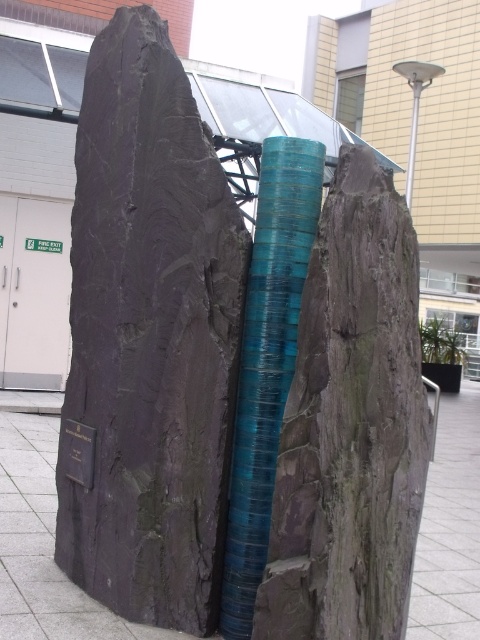
Can you confirm if teal glossy tube at center is positioned to the right of metallic pole at upper right?

In fact, teal glossy tube at center is to the left of metallic pole at upper right.

Describe the element at coordinates (266, 362) in the screenshot. I see `teal glossy tube at center` at that location.

This screenshot has width=480, height=640. What are the coordinates of `teal glossy tube at center` in the screenshot? It's located at (266, 362).

Which is more to the right, rough stone boulder at center or metallic pole at upper right?

Positioned to the right is metallic pole at upper right.

Between point (273, 628) and point (411, 128), which one is positioned in front?

Positioned in front is point (273, 628).

Find the location of `rough stone boulder at center`. rough stone boulder at center is located at coordinates point(350,426).

Identify the location of rough stone boulder at center. 350,426.

Which is in front, point (344, 524) or point (228, 596)?

Point (344, 524)

Does point (268, 602) lie behind point (256, 529)?

That is False.

I want to click on rough stone boulder at center, so click(x=350, y=426).